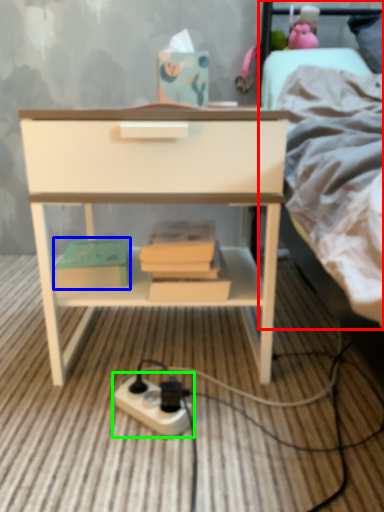
Question: Considering the real-world distances, which object is farthest from bed (highlighted by a red box)? paperback book (highlighted by a blue box) or power plugs and sockets (highlighted by a green box)?

Choices:
 (A) paperback book
 (B) power plugs and sockets

Answer: (B)